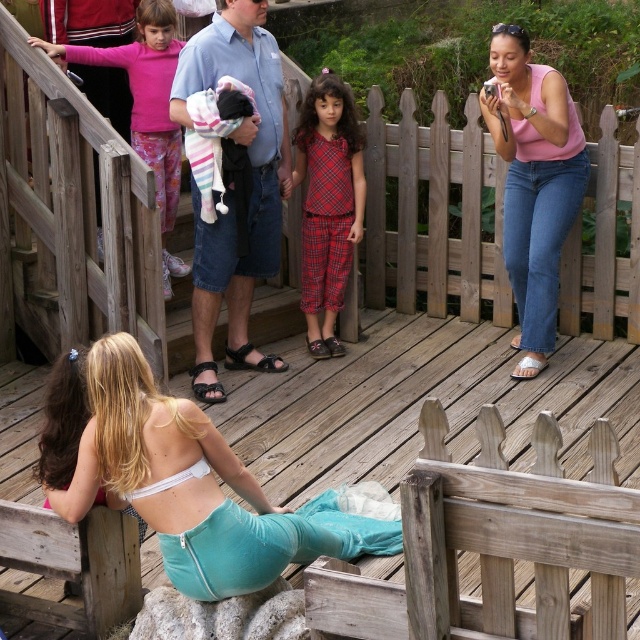
Question: Does pink cotton tank top at upper right appear over pink fabric pants at upper left?

Choices:
 (A) yes
 (B) no

Answer: (B)

Question: Based on their relative distances, which object is nearer to the white fabric bikini top at lower left?

Choices:
 (A) plaid fabric pajamas at center
 (B) pink fabric pants at upper left

Answer: (A)

Question: Based on their relative distances, which object is farther from the plaid fabric pajamas at center?

Choices:
 (A) pink fabric pants at upper left
 (B) pink cotton tank top at upper right
 (C) light blue denim shorts at center

Answer: (B)

Question: Is pink cotton tank top at upper right further to the viewer compared to pink fabric pants at upper left?

Choices:
 (A) yes
 (B) no

Answer: (B)

Question: Estimate the real-world distances between objects in this image. Which object is closer to the light blue denim shorts at center?

Choices:
 (A) pink fabric pants at upper left
 (B) pink cotton tank top at upper right

Answer: (A)

Question: Can you confirm if pink cotton tank top at upper right is positioned to the right of pink fabric pants at upper left?

Choices:
 (A) yes
 (B) no

Answer: (A)